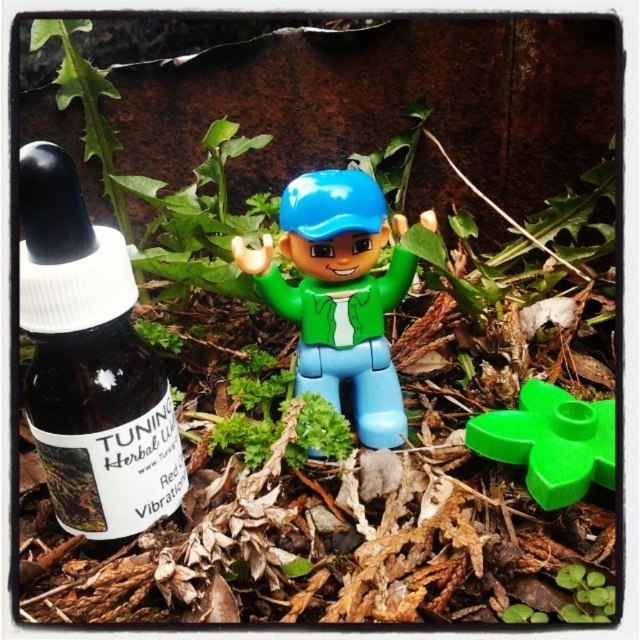
Based on the photo, you are designing a display for a toy store and need to place the matte plastic toy at center and the green plastic flower at center on a shelf. The shelf has limited space, and you want to ensure that the wider object is placed first to optimize space. Which object should you place first?

The matte plastic toy at center should be placed first because it is wider than the green plastic flower at center, allowing for better space optimization.

You are organizing a small display for a toy store and need to place the transparent glass bottle at left and the matte plastic toy at center on a shelf. The shelf has a height limit of 15 cm. Can both items fit vertically on the shelf without exceeding the height limit?

The transparent glass bottle at left has a smaller size compared to matte plastic toy at center. However, the exact height of each item is not specified in the provided description. Therefore, it is uncertain if both items will fit within the 15 cm height limit without more information about their individual heights.

What is the spatial relationship between the transparent glass bottle at left and the green plastic flower at center?

The transparent glass bottle at left is positioned in front of the green plastic flower at center.